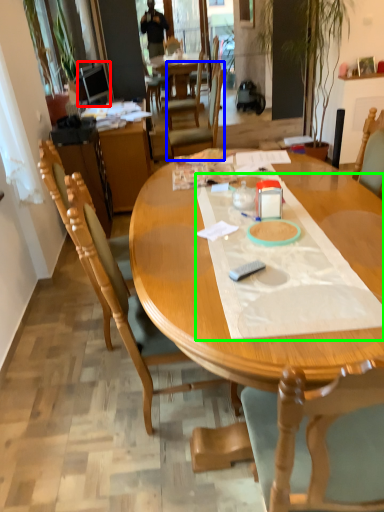
Question: Which object is the farthest from television (highlighted by a red box)? Choose among these: chair (highlighted by a blue box) or sheet (highlighted by a green box).

Choices:
 (A) chair
 (B) sheet

Answer: (B)